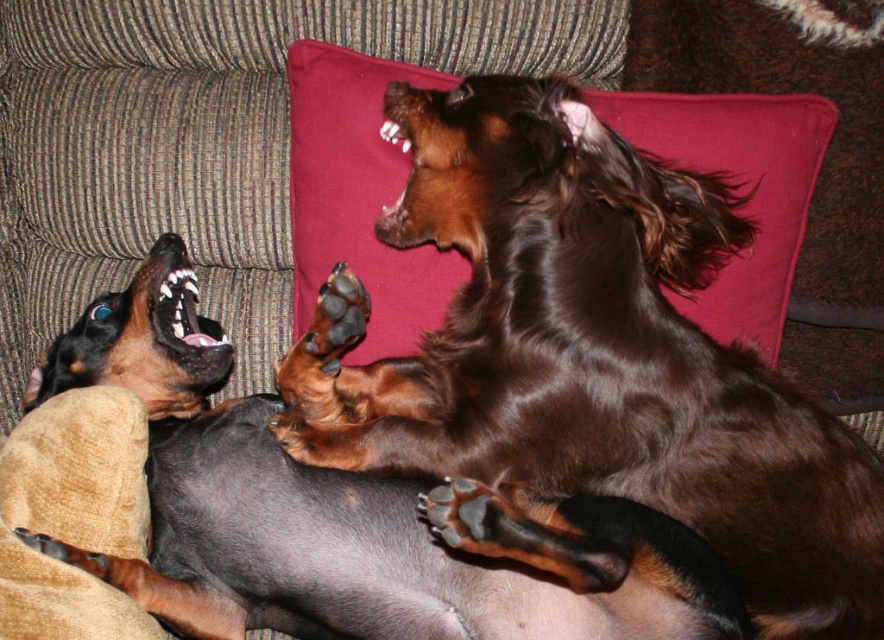
Looking at this image, does black glossy dog at center appear over brown furry dog at upper right?

Actually, black glossy dog at center is below brown furry dog at upper right.

Is black glossy dog at center in front of brown furry dog at upper right?

That is True.

Is point (608, 628) more distant than point (652, 35)?

No.

This screenshot has height=640, width=884. I want to click on black glossy dog at center, so click(351, 515).

Who is positioned more to the right, velvet cushion at upper center or brown furry dog at upper right?

From the viewer's perspective, brown furry dog at upper right appears more on the right side.

In the scene shown: Is velvet cushion at upper center positioned at the back of brown furry dog at upper right?

That is False.

Is point (354, 268) more distant than point (822, 35)?

Yes, point (354, 268) is farther from viewer.

Where is `velvet cushion at upper center`? velvet cushion at upper center is located at coordinates (357, 196).

Between point (737, 608) and point (306, 252), which one is positioned behind?

The point (306, 252) is more distant.

Can you confirm if black glossy dog at center is shorter than velvet cushion at upper center?

In fact, black glossy dog at center may be taller than velvet cushion at upper center.

Between point (197, 467) and point (664, 129), which one is positioned behind?

The point (664, 129) is more distant.

This screenshot has height=640, width=884. I want to click on black glossy dog at center, so click(351, 515).